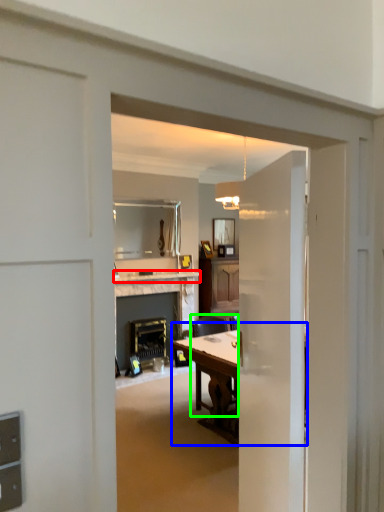
Question: Which object is the closest to the counter top (highlighted by a red box)? Choose among these: table (highlighted by a blue box) or chair (highlighted by a green box).

Choices:
 (A) table
 (B) chair

Answer: (B)